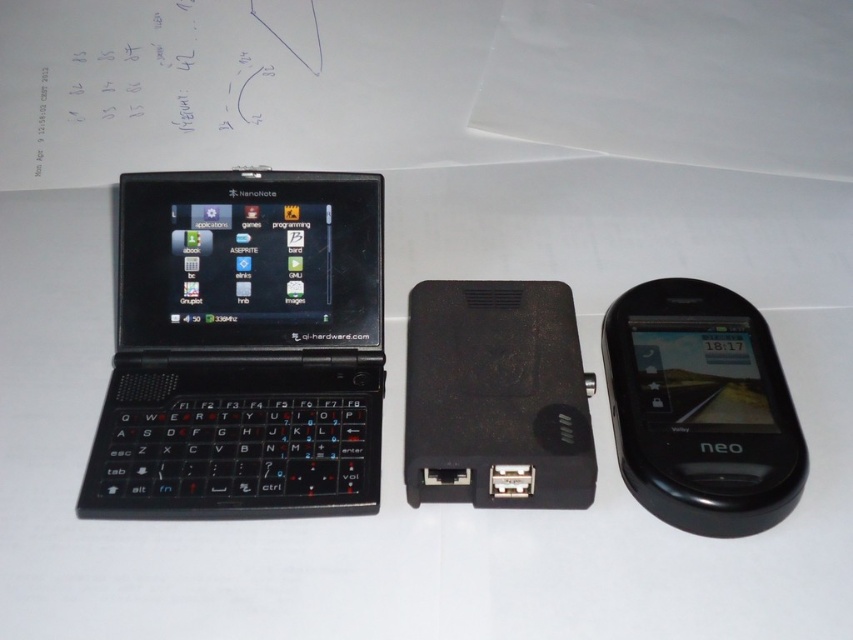
Is black matte laptop at left to the right of black glossy neo phone at right from the viewer's perspective?

Incorrect, black matte laptop at left is not on the right side of black glossy neo phone at right.

Which of these two, black matte laptop at left or black glossy neo phone at right, stands taller?

black matte laptop at left is taller.

Image resolution: width=853 pixels, height=640 pixels. What are the coordinates of `black matte laptop at left` in the screenshot? It's located at (242, 348).

Where is `black matte laptop at left`? black matte laptop at left is located at coordinates (242, 348).